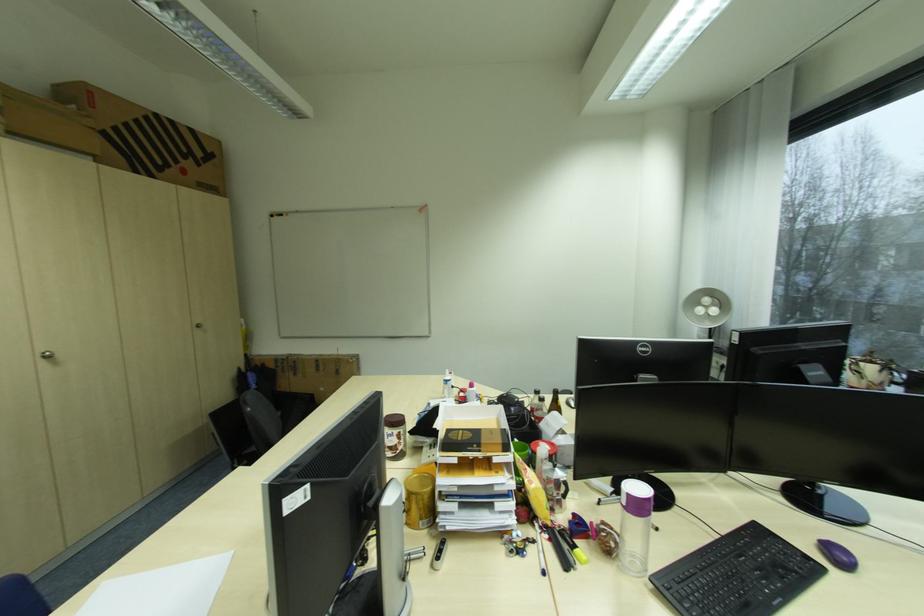
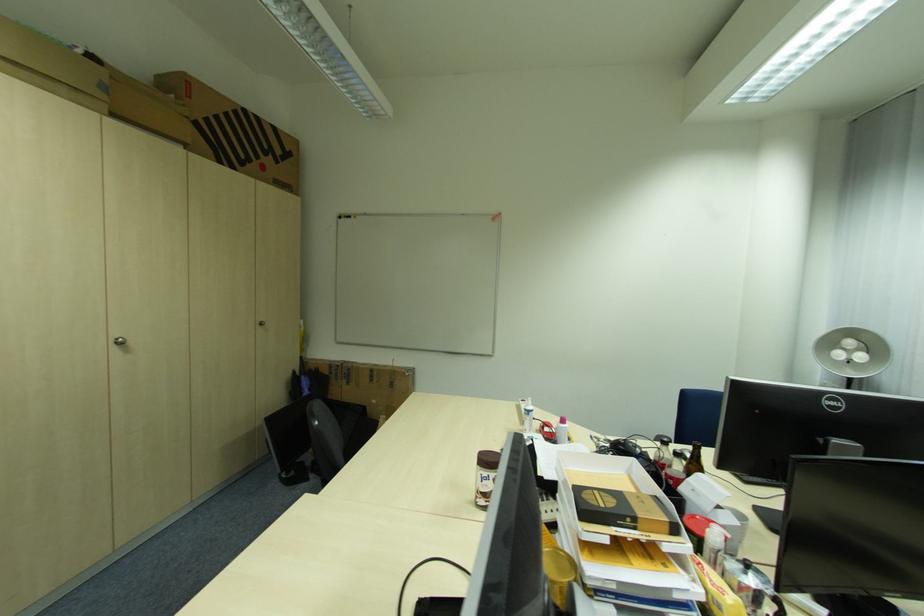
Looking at this image, what movement of the cameraman would produce the second image?

The movement direction of the cameraman is left, forward.